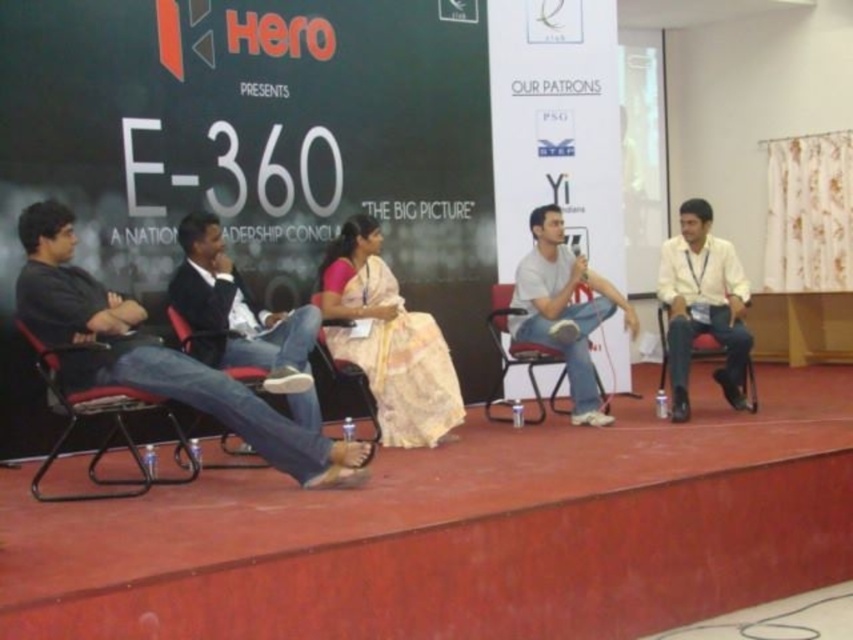
You are a photographer standing at the back of the stage, and you want to take a photo of both the point at coordinates point (497, 300) and point (231, 452) in the image. Which point is closer to your camera lens?

Point (231, 452) is closer to the camera lens because it is positioned nearer than point (497, 300), which is further away from the camera.

From the picture: You are an attendee at the panel discussion and want to approach the person wearing the black cotton shirt at left. Since the metallic black chair at left is in the way, can you walk around it to get closer?

The black cotton shirt at left is in front of the metallic black chair at left, so the chair is behind the person. You can approach the person directly without needing to go around the chair.

You are a photographer positioned at the back of the stage. You want to take a photo of the silk saree at center and ensure that all participants are in focus. Given that your camera has a depth of field that can cover 4 meters, will you be able to capture everyone clearly?

The silk saree at center is 4.62 meters away from the photographer. Since the camera can only cover 4 meters, it won not be able to capture everyone clearly within the depth of field.